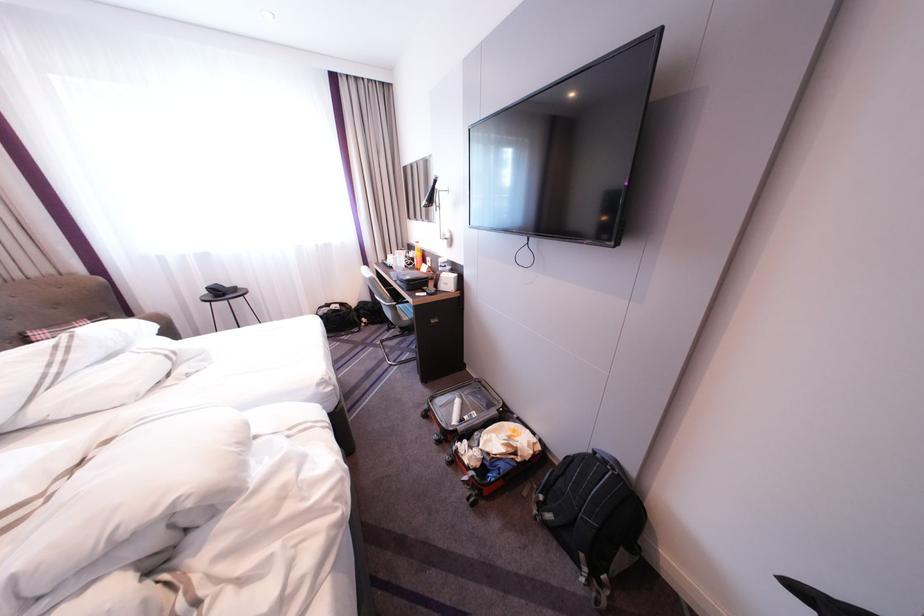
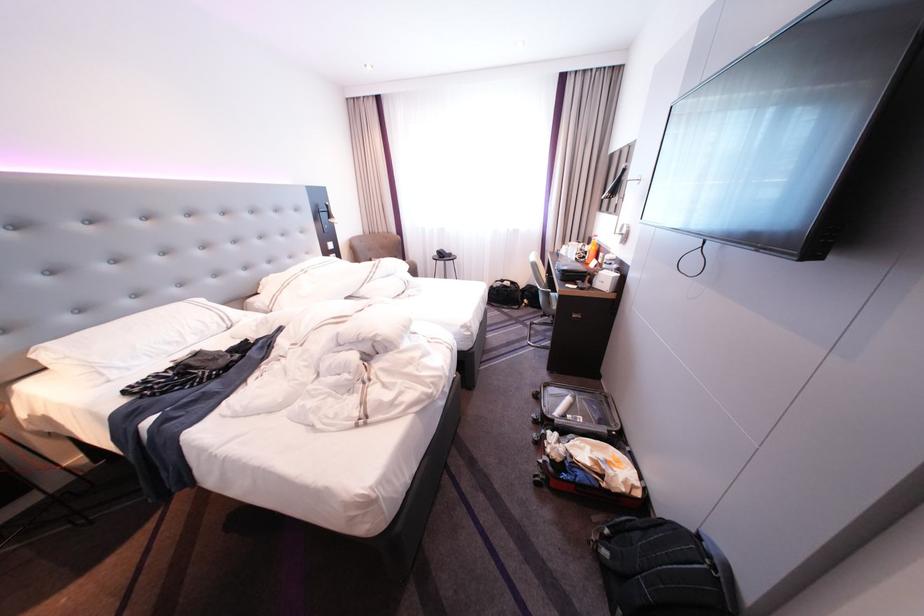
In the second image, find the point that corresponds to point (417, 253) in the first image.

(593, 245)